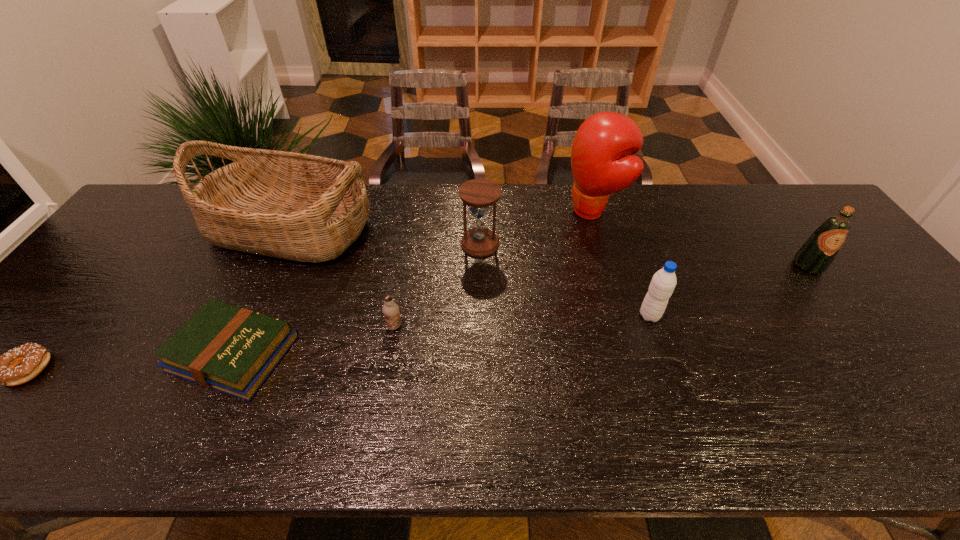
Locate an element on the screen. vacant space at the far edge of the desktop is located at coordinates (726, 206).

Locate an element on the screen. The width and height of the screenshot is (960, 540). free space at the near edge is located at coordinates (89, 443).

This screenshot has width=960, height=540. I want to click on blank area at the left edge, so click(141, 276).

Find the location of a particular element. The image size is (960, 540). vacant region at the right edge of the desktop is located at coordinates (954, 376).

Where is `free space at the far right corner of the desktop`? The width and height of the screenshot is (960, 540). free space at the far right corner of the desktop is located at coordinates (789, 187).

The height and width of the screenshot is (540, 960). What are the coordinates of `vacant space at the near right corner of the desktop` in the screenshot? It's located at (949, 453).

The height and width of the screenshot is (540, 960). Identify the location of vacant space that's between the fourth object from right to left and the book. (357, 298).

This screenshot has width=960, height=540. In order to click on vacant area between the basket and the book in this screenshot , I will do [262, 291].

Locate an element on the screen. Image resolution: width=960 pixels, height=540 pixels. free spot between the book and the water bottle is located at coordinates (442, 334).

The width and height of the screenshot is (960, 540). Identify the location of vacant space that is in between the seventh tallest object and the water bottle. (442, 334).